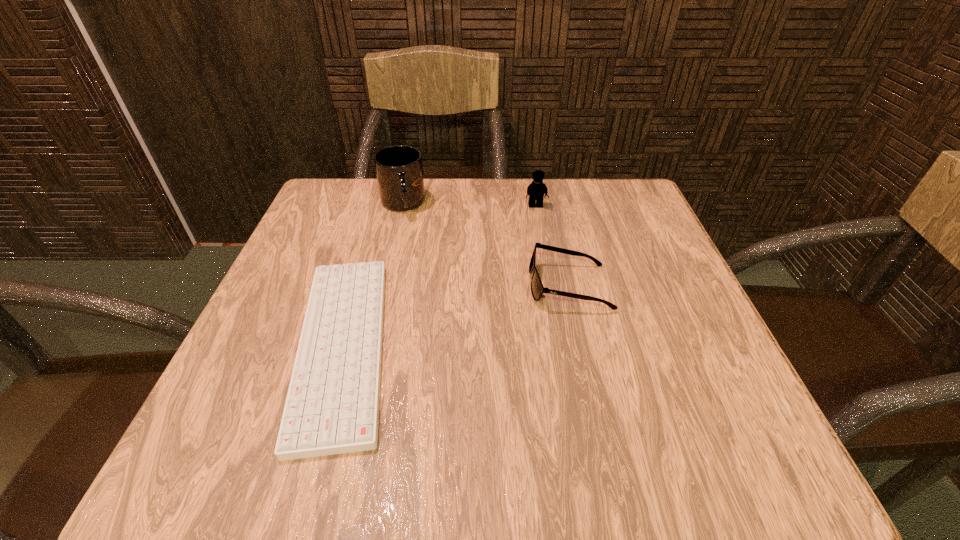
Find the location of a particular element. unoccupied position between the shortest object and the sunglasses is located at coordinates (456, 315).

Select which object is the closest to the second tallest object. Please provide its 2D coordinates. Your answer should be formatted as a tuple, i.e. [(x, y)], where the tuple contains the x and y coordinates of a point satisfying the conditions above.

[(537, 289)]

Choose which object is the nearest neighbor to the computer keyboard. Please provide its 2D coordinates. Your answer should be formatted as a tuple, i.e. [(x, y)], where the tuple contains the x and y coordinates of a point satisfying the conditions above.

[(399, 171)]

Locate an element on the screen. The height and width of the screenshot is (540, 960). free spot that satisfies the following two spatial constraints: 1. on the front-facing side of the sunglasses; 2. on the front side of the computer keyboard is located at coordinates (582, 346).